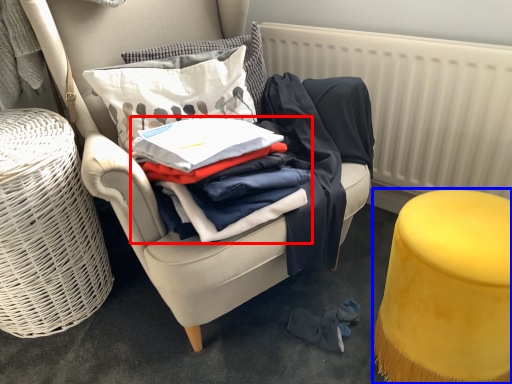
Question: Which point is closer to the camera, clothing (highlighted by a red box) or stool (highlighted by a blue box)?

Choices:
 (A) clothing
 (B) stool

Answer: (B)